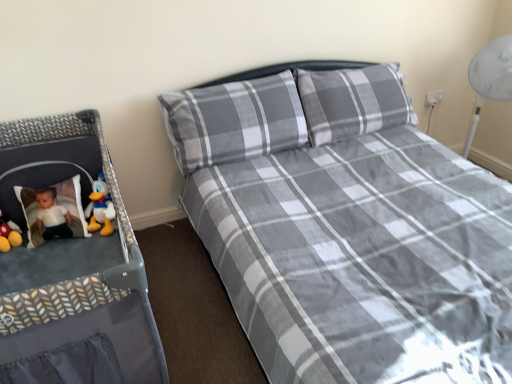
Question: Considering the relative positions of gray plaid pillow at center and gray plaid bed at center in the image provided, is gray plaid pillow at center to the left of gray plaid bed at center from the viewer's perspective?

Choices:
 (A) yes
 (B) no

Answer: (A)

Question: Is gray plaid pillow at center wider than gray plaid bed at center?

Choices:
 (A) yes
 (B) no

Answer: (B)

Question: Does gray plaid pillow at center have a larger size compared to gray plaid bed at center?

Choices:
 (A) no
 (B) yes

Answer: (A)

Question: Is gray plaid pillow at center positioned with its back to gray plaid bed at center?

Choices:
 (A) no
 (B) yes

Answer: (B)

Question: Is gray plaid pillow at center directly adjacent to gray plaid bed at center?

Choices:
 (A) no
 (B) yes

Answer: (A)

Question: From the image's perspective, is gray plaid bed at center above or below gray plaid pillow at center?

Choices:
 (A) above
 (B) below

Answer: (B)

Question: Does point (369, 311) appear closer or farther from the camera than point (209, 109)?

Choices:
 (A) closer
 (B) farther

Answer: (A)

Question: From their relative heights in the image, would you say gray plaid bed at center is taller or shorter than gray plaid pillow at center?

Choices:
 (A) short
 (B) tall

Answer: (B)

Question: Considering the positions of gray plaid bed at center and gray plaid pillow at center in the image, is gray plaid bed at center wider or thinner than gray plaid pillow at center?

Choices:
 (A) wide
 (B) thin

Answer: (A)

Question: From the image's perspective, is matte yellow duck at left positioned above or below gray plaid pillow at center?

Choices:
 (A) above
 (B) below

Answer: (B)

Question: Considering their positions, is matte yellow duck at left located in front of or behind gray plaid pillow at center?

Choices:
 (A) behind
 (B) front

Answer: (A)

Question: From a real-world perspective, is matte yellow duck at left physically located above or below gray plaid pillow at center?

Choices:
 (A) below
 (B) above

Answer: (A)

Question: Visually, is matte yellow duck at left positioned to the left or to the right of gray plaid pillow at center?

Choices:
 (A) right
 (B) left

Answer: (B)

Question: From a real-world perspective, relative to gray plaid bed at center, is gray plaid pillow at center vertically above or below?

Choices:
 (A) above
 (B) below

Answer: (A)

Question: From the image's perspective, is gray plaid pillow at center positioned above or below gray plaid bed at center?

Choices:
 (A) below
 (B) above

Answer: (B)